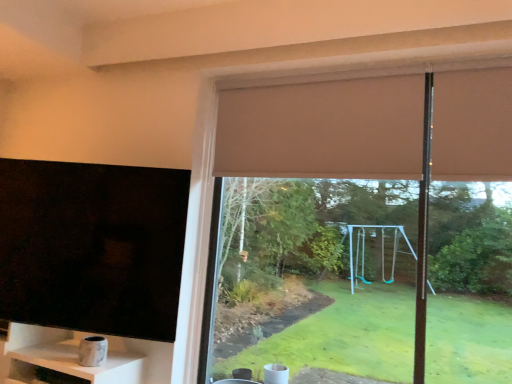
Question: Does point (349, 135) appear closer or farther from the camera than point (36, 360)?

Choices:
 (A) farther
 (B) closer

Answer: (A)

Question: Is beige fabric curtain at upper center situated inside marble-like white shelf at lower left or outside?

Choices:
 (A) outside
 (B) inside

Answer: (A)

Question: Which of these objects is positioned farthest from the marble-like white shelf at lower left?

Choices:
 (A) black matte tv at left
 (B) beige fabric curtain at upper center
 (C) matte brown roller blind at upper center

Answer: (B)

Question: Which object is positioned closest to the black matte tv at left?

Choices:
 (A) beige fabric curtain at upper center
 (B) matte brown roller blind at upper center
 (C) marble-like white shelf at lower left

Answer: (C)